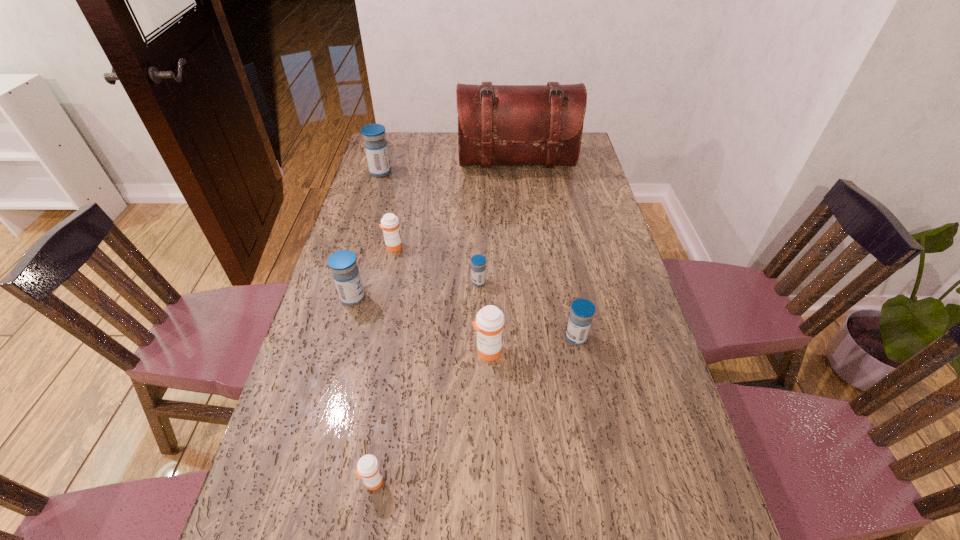
Point out which object is positioned as the second nearest to the fourth farthest medicine. Please provide its 2D coordinates. Your answer should be formatted as a tuple, i.e. [(x, y)], where the tuple contains the x and y coordinates of a point satisfying the conditions above.

[(478, 268)]

Locate an element on the screen. This screenshot has width=960, height=540. the third closest object to the rightmost orange medicine is located at coordinates (368, 468).

Find the location of a particular element. the third closest medicine to the satchel is located at coordinates (478, 268).

Locate an element on the screen. This screenshot has height=540, width=960. medicine that can be found as the closest to the smallest blue medicine is located at coordinates (489, 323).

This screenshot has width=960, height=540. Identify the location of blue medicine that is the second closest to the smallest blue medicine. (342, 263).

Find the location of a particular element. blue medicine that is the closest one to the second farthest orange medicine is located at coordinates (582, 310).

You are a GUI agent. You are given a task and a screenshot of the screen. Output one action in this format:
    pyautogui.click(x=<x>, y=<y>)
    Task: Click on the second closest orange medicine to the nearest orange medicine
    
    Given the screenshot: What is the action you would take?
    pyautogui.click(x=389, y=223)

Locate which orange medicine ranks third in proximity to the brown satchel. Please provide its 2D coordinates. Your answer should be formatted as a tuple, i.e. [(x, y)], where the tuple contains the x and y coordinates of a point satisfying the conditions above.

[(368, 468)]